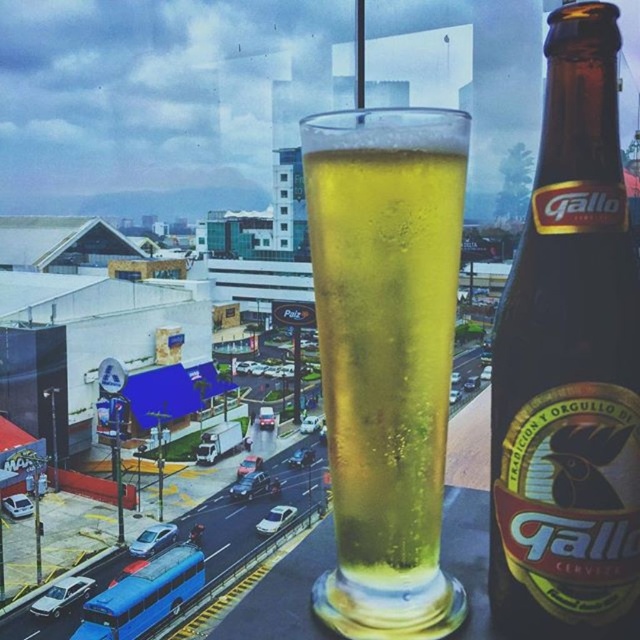
Question: From the image, what is the correct spatial relationship of brown glass bottle at center in relation to translucent glass at center?

Choices:
 (A) above
 (B) below

Answer: (A)

Question: Observing the image, what is the correct spatial positioning of brown glass bottle at center in reference to translucent glass at center?

Choices:
 (A) above
 (B) below

Answer: (A)

Question: Which point is closer to the camera?

Choices:
 (A) (596, 214)
 (B) (349, 136)

Answer: (A)

Question: Is brown glass bottle at center behind translucent glass at center?

Choices:
 (A) yes
 (B) no

Answer: (B)